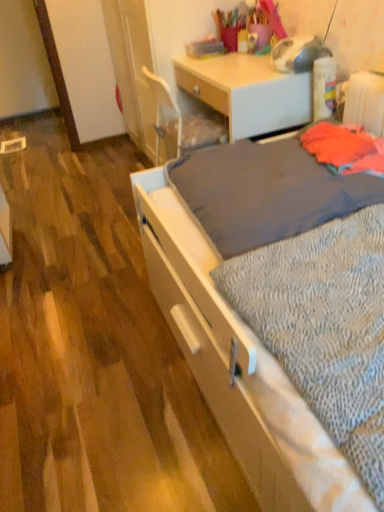
This screenshot has height=512, width=384. Describe the element at coordinates (247, 92) in the screenshot. I see `matte wood desk at center` at that location.

Locate an element on the screen. This screenshot has width=384, height=512. textured gray blanket at center is located at coordinates (265, 192).

Which is in front, point (297, 428) or point (233, 84)?

The point (297, 428) is more forward.

Considering the relative positions of white wood bed at center and matte wood desk at center in the image provided, is white wood bed at center to the left of matte wood desk at center from the viewer's perspective?

No.

Is white wood bed at center outside of matte wood desk at center?

Absolutely, white wood bed at center is external to matte wood desk at center.

From the image's perspective, which is above, white wood bed at center or matte wood desk at center?

matte wood desk at center, from the image's perspective.

Is textured gray blanket at center at the left side of matte wood desk at center?

Incorrect, textured gray blanket at center is not on the left side of matte wood desk at center.

From the image's perspective, between textured gray blanket at center and matte wood desk at center, which one is located above?

matte wood desk at center appears higher in the image.

Is textured gray blanket at center spatially inside matte wood desk at center, or outside of it?

textured gray blanket at center is not inside matte wood desk at center, it's outside.

Does textured gray blanket at center have a lesser height compared to matte wood desk at center?

Yes, textured gray blanket at center is shorter than matte wood desk at center.

Consider the image. Does gray textured sheet at center turn towards textured gray blanket at center?

No.

Which of these two, gray textured sheet at center or textured gray blanket at center, is thinner?

With smaller width is gray textured sheet at center.

From a real-world perspective, which object stands above the other?

In real-world perspective, textured gray blanket at center is above.

Based on their sizes in the image, would you say gray textured sheet at center is bigger or smaller than textured gray blanket at center?

Clearly, gray textured sheet at center is smaller in size than textured gray blanket at center.

Does gray textured sheet at center have a greater width compared to white wood bed at center?

In fact, gray textured sheet at center might be narrower than white wood bed at center.

Considering the sizes of objects gray textured sheet at center and white wood bed at center in the image provided, who is smaller, gray textured sheet at center or white wood bed at center?

gray textured sheet at center.

Is gray textured sheet at center positioned beyond the bounds of white wood bed at center?

No, gray textured sheet at center is inside or overlapping with white wood bed at center.

From a real-world perspective, is gray textured sheet at center over white wood bed at center?

Correct, in the physical world, gray textured sheet at center is higher than white wood bed at center.

Is textured gray blanket at center bigger or smaller than gray textured sheet at center?

textured gray blanket at center is bigger than gray textured sheet at center.

At what (x,y) coordinates should I click in order to perform the action: click on blanket above the gray textured sheet at center (from the image's perspective). Please return your answer as a coordinate pair (x, y). Image resolution: width=384 pixels, height=512 pixels. Looking at the image, I should click on (265, 192).

Is point (254, 213) positioned behind point (357, 470)?

That is True.

Between textured gray blanket at center and gray textured sheet at center, which one has less height?

gray textured sheet at center.

Between textured gray blanket at center and white wood bed at center, which one appears on the right side from the viewer's perspective?

Positioned to the right is white wood bed at center.

From their relative heights in the image, would you say textured gray blanket at center is taller or shorter than white wood bed at center?

textured gray blanket at center is shorter than white wood bed at center.

Is textured gray blanket at center facing towards white wood bed at center?

Yes, textured gray blanket at center is facing white wood bed at center.

From a real-world perspective, is textured gray blanket at center on top of white wood bed at center?

Yes.

Which is behind, point (326, 358) or point (242, 71)?

The point (242, 71) is farther.

Can you confirm if gray textured sheet at center is wider than matte wood desk at center?

Yes.

Is gray textured sheet at center taller than matte wood desk at center?

No, gray textured sheet at center is not taller than matte wood desk at center.

Identify the location of bed located below the matte wood desk at center (from the image's perspective). The image size is (384, 512). (238, 366).

What are the coordinates of `desk behind the textured gray blanket at center` in the screenshot? It's located at (247, 92).

From the image, which object appears to be nearer to matte wood desk at center, white wood bed at center or textured gray blanket at center?

textured gray blanket at center is closer to matte wood desk at center.

From the image, which object appears to be nearer to textured gray blanket at center, matte wood desk at center or white wood bed at center?

Based on the image, white wood bed at center appears to be nearer to textured gray blanket at center.

Looking at the image, which one is located closer to textured gray blanket at center, gray textured sheet at center or matte wood desk at center?

Among the two, gray textured sheet at center is located nearer to textured gray blanket at center.

When comparing their distances from white wood bed at center, does textured gray blanket at center or gray textured sheet at center seem closer?

gray textured sheet at center lies closer to white wood bed at center than the other object.

From the picture: From the image, which object appears to be farther from white wood bed at center, gray textured sheet at center or matte wood desk at center?

The object further to white wood bed at center is matte wood desk at center.

When comparing their distances from gray textured sheet at center, does matte wood desk at center or textured gray blanket at center seem further?

matte wood desk at center.

Estimate the real-world distances between objects in this image. Which object is closer to white wood bed at center, gray textured sheet at center or textured gray blanket at center?

The object closer to white wood bed at center is gray textured sheet at center.

Looking at the image, which one is located closer to textured gray blanket at center, matte wood desk at center or gray textured sheet at center?

Among the two, gray textured sheet at center is located nearer to textured gray blanket at center.

The height and width of the screenshot is (512, 384). I want to click on blanket between white wood bed at center and matte wood desk at center from front to back, so click(265, 192).

Locate an element on the screen. This screenshot has height=512, width=384. sheet between white wood bed at center and matte wood desk at center from front to back is located at coordinates (324, 327).

Identify the location of sheet between white wood bed at center and textured gray blanket at center from front to back. This screenshot has height=512, width=384. (324, 327).

At what (x,y) coordinates should I click in order to perform the action: click on blanket between gray textured sheet at center and matte wood desk at center from front to back. Please return your answer as a coordinate pair (x, y). The width and height of the screenshot is (384, 512). Looking at the image, I should click on (265, 192).